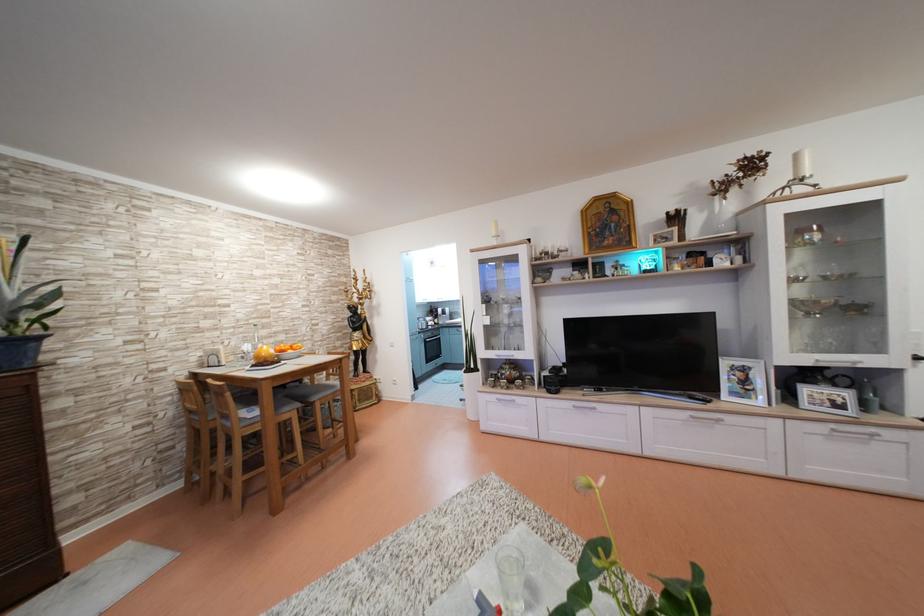
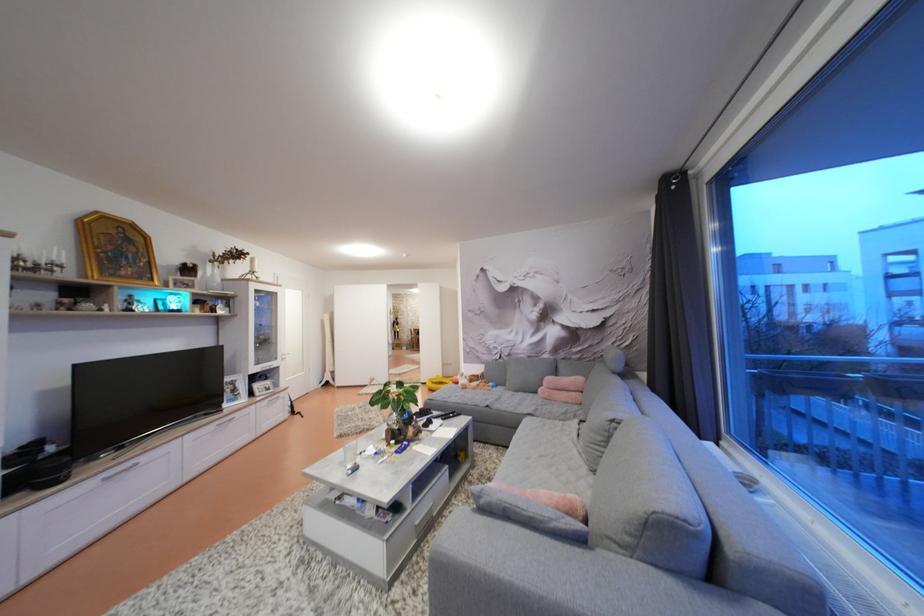
Where in the second image is the point corresponding to point (719, 217) from the first image?

(213, 278)